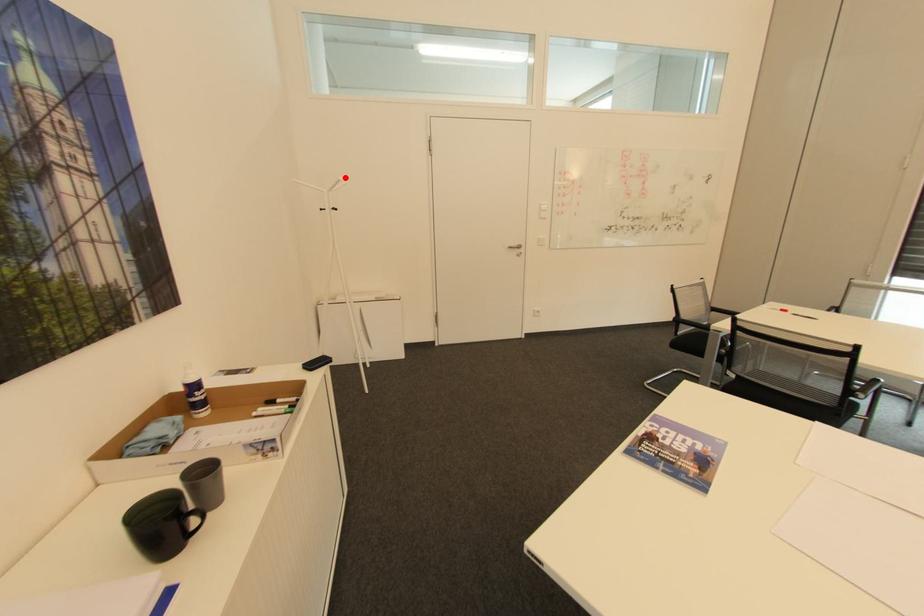
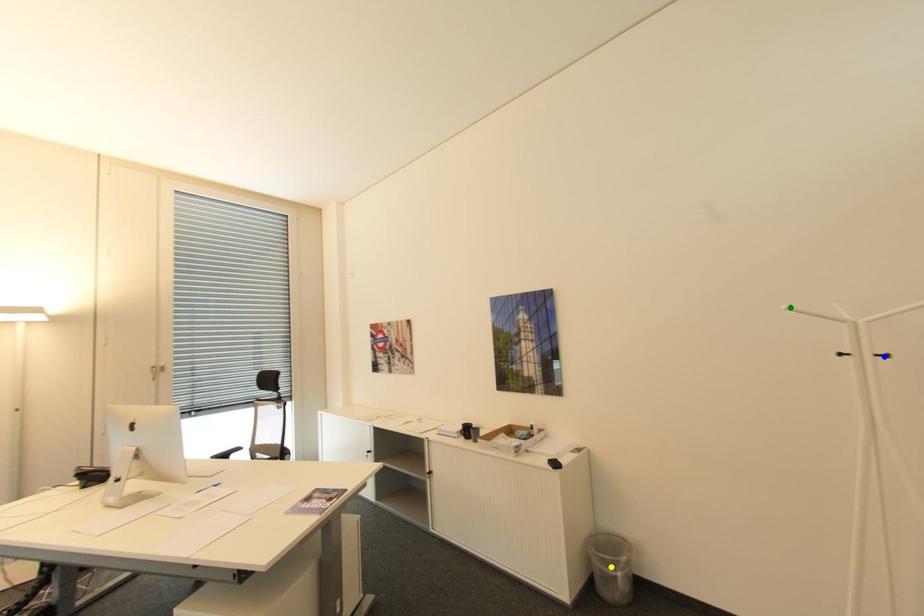
Question: I am providing you with two images of the same scene from different viewpoints. A red point is marked on the first image. You are given multiple points on the second image. In image 2, which mark is for the same physical point as the one in image 1?

Choices:
 (A) yellow point
 (B) blue point
 (C) green point

Answer: (C)